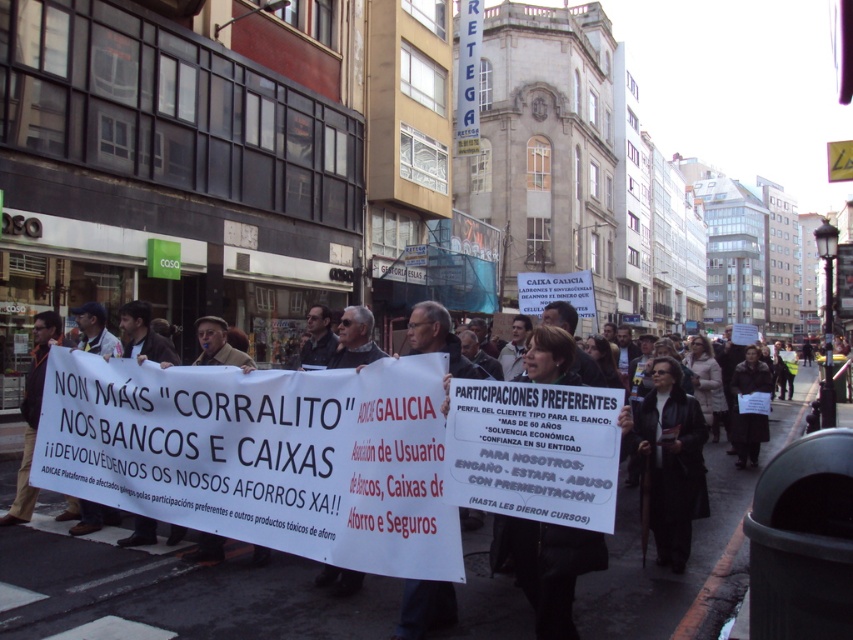
Identify the location of white paper sign at center. (171, 589).

Between white paper sign at center and dark brown leather jacket at lower left, which one appears on the right side from the viewer's perspective?

Positioned to the right is white paper sign at center.

Describe the element at coordinates (171, 589) in the screenshot. This screenshot has height=640, width=853. I see `white paper sign at center` at that location.

Image resolution: width=853 pixels, height=640 pixels. I want to click on white paper sign at center, so click(171, 589).

Who is taller, black leather coat at center or dark brown leather jacket at lower left?

Standing taller between the two is black leather coat at center.

Does black leather coat at center appear on the left side of dark brown leather jacket at lower left?

No, black leather coat at center is not to the left of dark brown leather jacket at lower left.

Which is behind, point (664, 461) or point (36, 323)?

Positioned behind is point (36, 323).

I want to click on black leather coat at center, so click(671, 461).

Is white paper sign at center bigger than black leather coat at center?

Yes, white paper sign at center is bigger than black leather coat at center.

Who is more distant from viewer, (776,410) or (657,392)?

Positioned behind is point (776,410).

Find the location of a particular element. white paper sign at center is located at coordinates (171, 589).